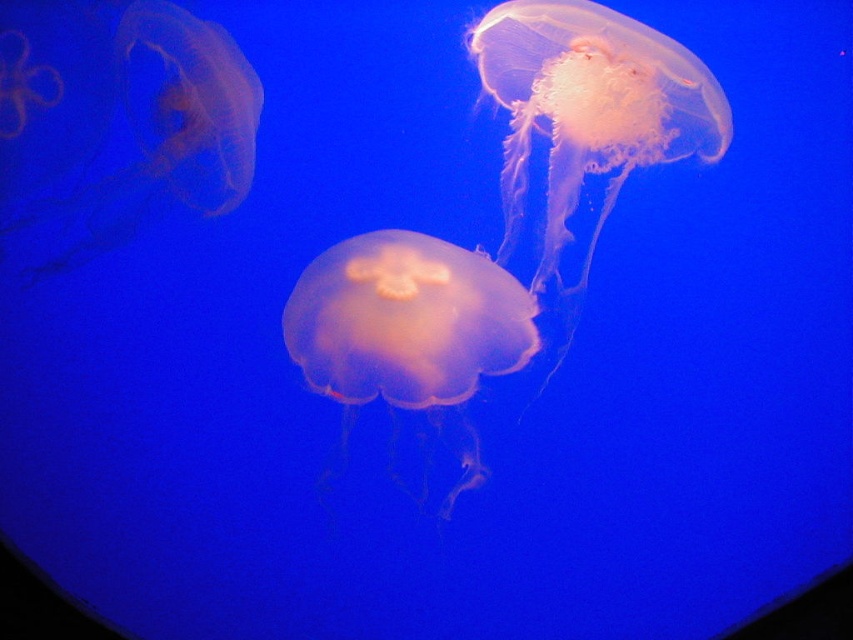
Is translucent orange jellyfish at center positioned in front of translucent pink jellyfish at upper left?

Yes, translucent orange jellyfish at center is in front of translucent pink jellyfish at upper left.

Image resolution: width=853 pixels, height=640 pixels. In order to click on translucent orange jellyfish at center in this screenshot , I will do `click(408, 332)`.

The height and width of the screenshot is (640, 853). In order to click on translucent orange jellyfish at center in this screenshot , I will do `click(408, 332)`.

How far apart are translucent pink jellyfish at center and translucent orange jellyfish at center?

8.78 inches

Can you confirm if translucent pink jellyfish at center is shorter than translucent orange jellyfish at center?

No, translucent pink jellyfish at center is not shorter than translucent orange jellyfish at center.

The width and height of the screenshot is (853, 640). Identify the location of translucent pink jellyfish at center. (589, 113).

Between point (721, 113) and point (199, 113), which one is positioned behind?

Positioned behind is point (199, 113).

Which is in front, point (654, 116) or point (184, 99)?

Point (184, 99) is more forward.

Locate an element on the screen. This screenshot has height=640, width=853. translucent pink jellyfish at center is located at coordinates (589, 113).

Locate an element on the screen. translucent pink jellyfish at center is located at coordinates (589, 113).